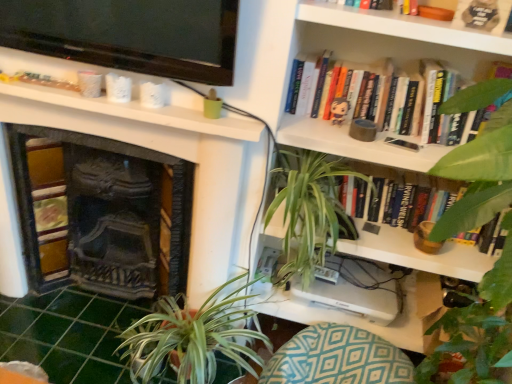
Question: Which direction should I rotate to look at teal diamond-patterned cushion at lower center?

Choices:
 (A) right
 (B) left

Answer: (A)

Question: Can you confirm if matte plastic toy at upper center is positioned to the right of green leafy plant at upper right, the first vegetation from the right?

Choices:
 (A) yes
 (B) no

Answer: (B)

Question: From the image's perspective, does matte plastic toy at upper center appear higher than green leafy plant at upper right, which appears as the second vegetation when viewed from the left?

Choices:
 (A) no
 (B) yes

Answer: (B)

Question: Is matte plastic toy at upper center wider than green leafy plant at upper right, the first vegetation from the right?

Choices:
 (A) yes
 (B) no

Answer: (B)

Question: Is matte plastic toy at upper center outside of green leafy plant at upper right, which appears as the second vegetation when viewed from the left?

Choices:
 (A) no
 (B) yes

Answer: (B)

Question: From a real-world perspective, is matte plastic toy at upper center over green leafy plant at upper right, the first vegetation from the right?

Choices:
 (A) yes
 (B) no

Answer: (A)

Question: Does matte plastic toy at upper center turn towards green leafy plant at upper right, which appears as the second vegetation when viewed from the left?

Choices:
 (A) yes
 (B) no

Answer: (B)

Question: Is matte plastic toy at upper center smaller than white glossy bookshelf at upper right?

Choices:
 (A) no
 (B) yes

Answer: (B)

Question: Is matte plastic toy at upper center surrounding white glossy bookshelf at upper right?

Choices:
 (A) no
 (B) yes

Answer: (A)

Question: Does matte plastic toy at upper center appear on the right side of white glossy bookshelf at upper right?

Choices:
 (A) no
 (B) yes

Answer: (A)

Question: Is matte plastic toy at upper center thinner than white glossy bookshelf at upper right?

Choices:
 (A) yes
 (B) no

Answer: (A)

Question: Is the depth of matte plastic toy at upper center less than that of white glossy bookshelf at upper right?

Choices:
 (A) yes
 (B) no

Answer: (B)

Question: Considering the relative sizes of matte plastic toy at upper center and white glossy bookshelf at upper right in the image provided, is matte plastic toy at upper center wider than white glossy bookshelf at upper right?

Choices:
 (A) yes
 (B) no

Answer: (B)

Question: Is the position of hardcover book at upper right, which is the first book in top-to-bottom order, less distant than that of teal diamond-patterned cushion at lower center?

Choices:
 (A) no
 (B) yes

Answer: (B)